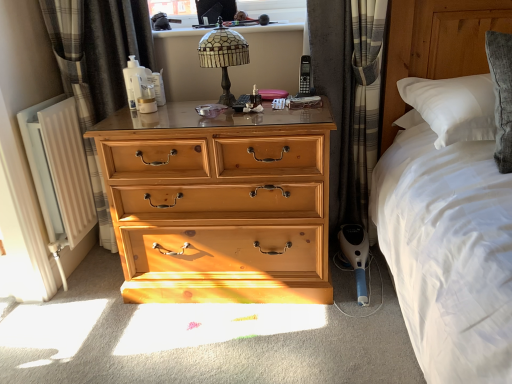
Question: Is stained glass lampshade at upper center behind plaid fabric curtain at right, the first curtain viewed from the right?

Choices:
 (A) yes
 (B) no

Answer: (B)

Question: Is stained glass lampshade at upper center wider than plaid fabric curtain at right, the first curtain viewed from the right?

Choices:
 (A) yes
 (B) no

Answer: (B)

Question: Can you confirm if stained glass lampshade at upper center is positioned to the left of plaid fabric curtain at right, which is the second curtain from left to right?

Choices:
 (A) no
 (B) yes

Answer: (B)

Question: Can you confirm if stained glass lampshade at upper center is bigger than plaid fabric curtain at right, which is the second curtain from left to right?

Choices:
 (A) yes
 (B) no

Answer: (B)

Question: Considering the relative positions of stained glass lampshade at upper center and plaid fabric curtain at right, which is the second curtain from left to right, in the image provided, is stained glass lampshade at upper center in front of plaid fabric curtain at right, which is the second curtain from left to right,?

Choices:
 (A) yes
 (B) no

Answer: (A)

Question: From the image's perspective, does stained glass lampshade at upper center appear lower than plaid fabric curtain at right, the first curtain viewed from the right?

Choices:
 (A) yes
 (B) no

Answer: (B)

Question: Can you confirm if wooden chest of drawers at center is wider than black plastic remote control at center?

Choices:
 (A) no
 (B) yes

Answer: (B)

Question: From the image's perspective, is wooden chest of drawers at center located above black plastic remote control at center?

Choices:
 (A) no
 (B) yes

Answer: (A)

Question: Does wooden chest of drawers at center lie behind black plastic remote control at center?

Choices:
 (A) yes
 (B) no

Answer: (B)

Question: From a real-world perspective, is wooden chest of drawers at center on top of black plastic remote control at center?

Choices:
 (A) no
 (B) yes

Answer: (A)

Question: Is wooden chest of drawers at center bigger than black plastic remote control at center?

Choices:
 (A) yes
 (B) no

Answer: (A)

Question: Is wooden chest of drawers at center positioned before black plastic remote control at center?

Choices:
 (A) no
 (B) yes

Answer: (B)

Question: Is plaid fabric curtain at right, the first curtain viewed from the right, positioned far away from stained glass lampshade at upper center?

Choices:
 (A) yes
 (B) no

Answer: (B)